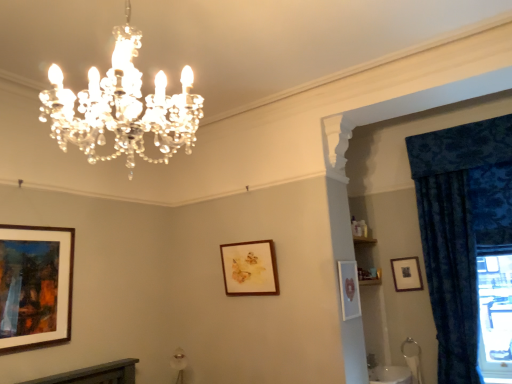
Question: Is wooden-framed painting at left, the 1th picture frame in the front-to-back sequence, inside the boundaries of matte white picture frame at center-right, positioned as the 3th picture frame in back-to-front order, or outside?

Choices:
 (A) outside
 (B) inside

Answer: (A)

Question: Considering the positions of wooden-framed painting at left, the 1th picture frame in the front-to-back sequence, and matte white picture frame at center-right, positioned as the second picture frame in right-to-left order, in the image, is wooden-framed painting at left, the 1th picture frame in the front-to-back sequence, bigger or smaller than matte white picture frame at center-right, positioned as the second picture frame in right-to-left order,?

Choices:
 (A) big
 (B) small

Answer: (A)

Question: Which is farther from the wooden picture frame at upper right, which is the 1th picture frame in right-to-left order?

Choices:
 (A) wooden picture frame at center, the second picture frame from the back
 (B) velvet blue curtain at right
 (C) wooden-framed painting at left, positioned as the 4th picture frame in right-to-left order
 (D) matte white picture frame at center-right, the second picture frame viewed from the front
 (E) clear crystal chandelier at upper center

Answer: (C)

Question: Based on their relative distances, which object is nearer to the wooden-framed painting at left, the 1th picture frame in the front-to-back sequence?

Choices:
 (A) clear crystal chandelier at upper center
 (B) wooden picture frame at upper right, which is the 4th picture frame from left to right
 (C) wooden picture frame at center, the 3th picture frame from the right
 (D) matte white picture frame at center-right, positioned as the 3th picture frame in back-to-front order
 (E) velvet blue curtain at right

Answer: (A)